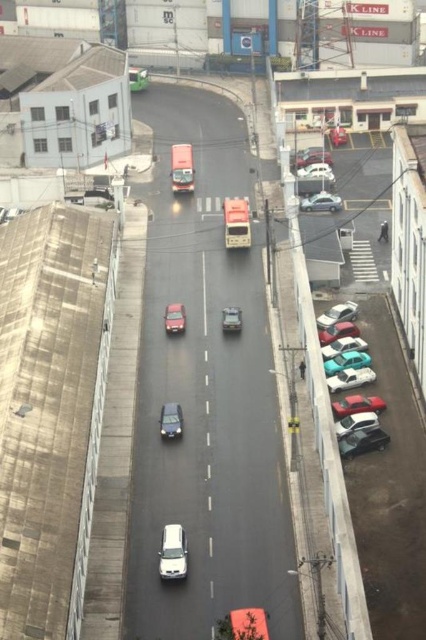
From the picture: Does shiny silver car at center lie behind metallic silver car at center?

No, it is in front of metallic silver car at center.

Who is positioned more to the left, shiny silver car at center or metallic silver car at center?

Positioned to the left is shiny silver car at center.

Looking at this image, measure the distance between shiny silver car at center and camera.

shiny silver car at center is 59.01 meters from camera.

This screenshot has height=640, width=426. Find the location of `shiny silver car at center`. shiny silver car at center is located at coordinates (170, 420).

Is smooth asphalt highway at center to the right of white matte van at center from the viewer's perspective?

Correct, you'll find smooth asphalt highway at center to the right of white matte van at center.

Can you confirm if smooth asphalt highway at center is wider than white matte van at center?

Correct, the width of smooth asphalt highway at center exceeds that of white matte van at center.

Is point (215, 353) in front of point (178, 548)?

No, (215, 353) is behind (178, 548).

Find the location of `smooth asphalt highway at center`. smooth asphalt highway at center is located at coordinates (206, 394).

Does point (173, 156) lie behind point (325, 204)?

Yes, point (173, 156) is behind point (325, 204).

Identify the location of matte silver van at center. The width and height of the screenshot is (426, 640). (181, 168).